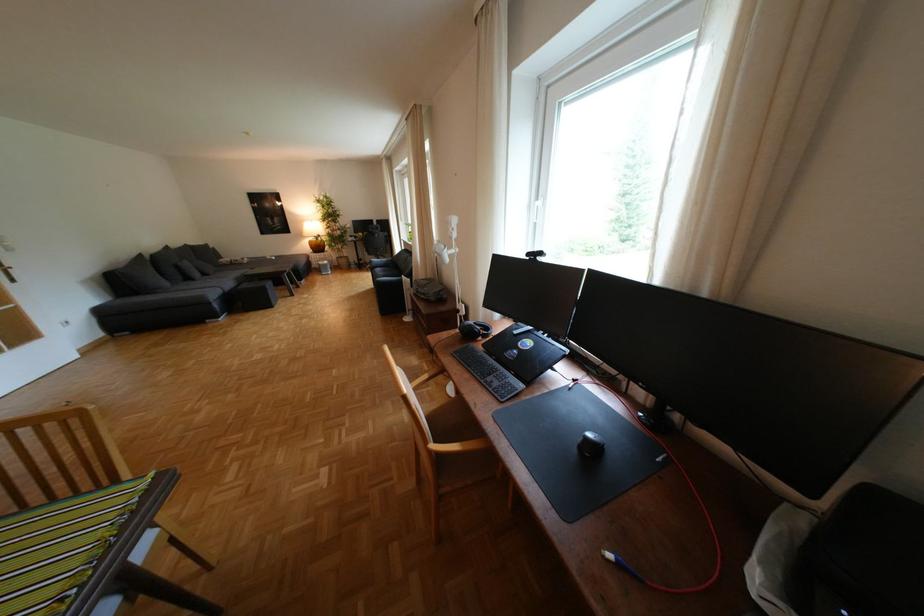
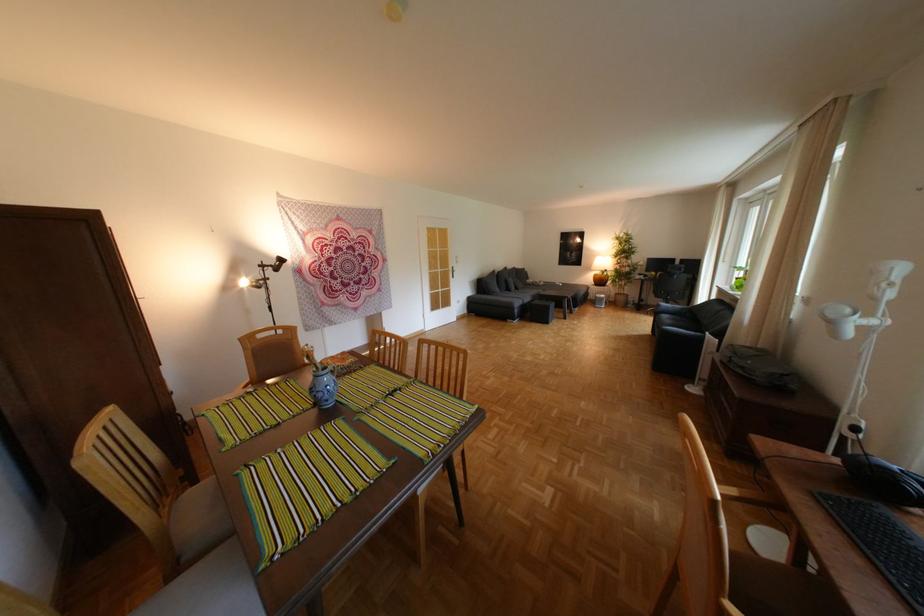
Find the pixel in the second image that matches [228,306] in the first image.

(529, 312)